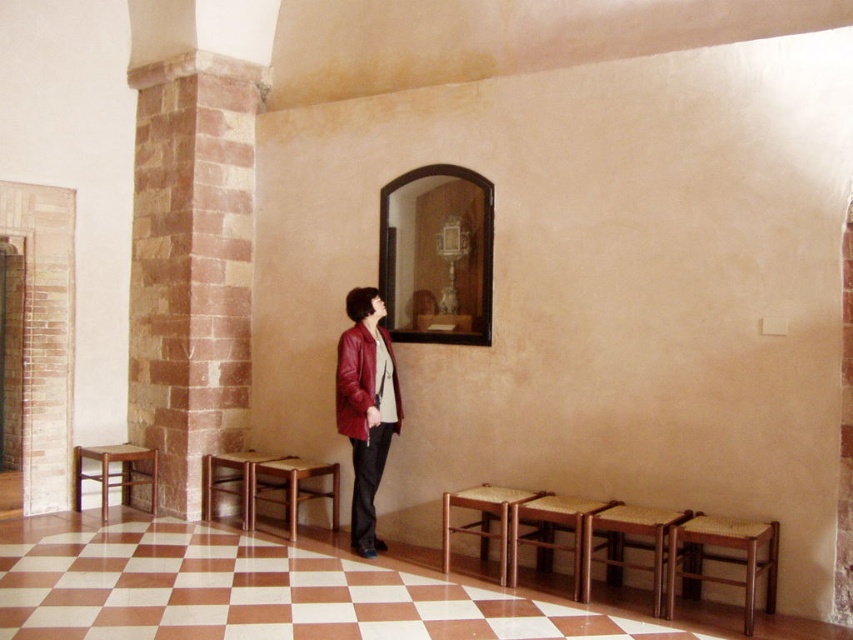
Question: Can you confirm if matte red leather jacket at center is thinner than wooden woven seat at lower center?

Choices:
 (A) no
 (B) yes

Answer: (B)

Question: Does leather jacket at center have a smaller size compared to wooden stool at center?

Choices:
 (A) yes
 (B) no

Answer: (A)

Question: Which of the following is the closest to the observer?

Choices:
 (A) (225, 492)
 (B) (387, 353)
 (C) (337, 502)
 (D) (132, 468)

Answer: (B)

Question: Estimate the real-world distances between objects in this image. Which object is farther from the rustic stone pillar at left?

Choices:
 (A) wooden woven seat at lower center
 (B) brown wooden stool at lower left
 (C) leather jacket at center

Answer: (A)

Question: Which point is closer to the camera?

Choices:
 (A) rustic stone pillar at left
 (B) brown wooden stool at lower left
 (C) wooden stool at center

Answer: (C)

Question: Is brown woven table at lower right wider than wooden table at lower center?

Choices:
 (A) no
 (B) yes

Answer: (A)